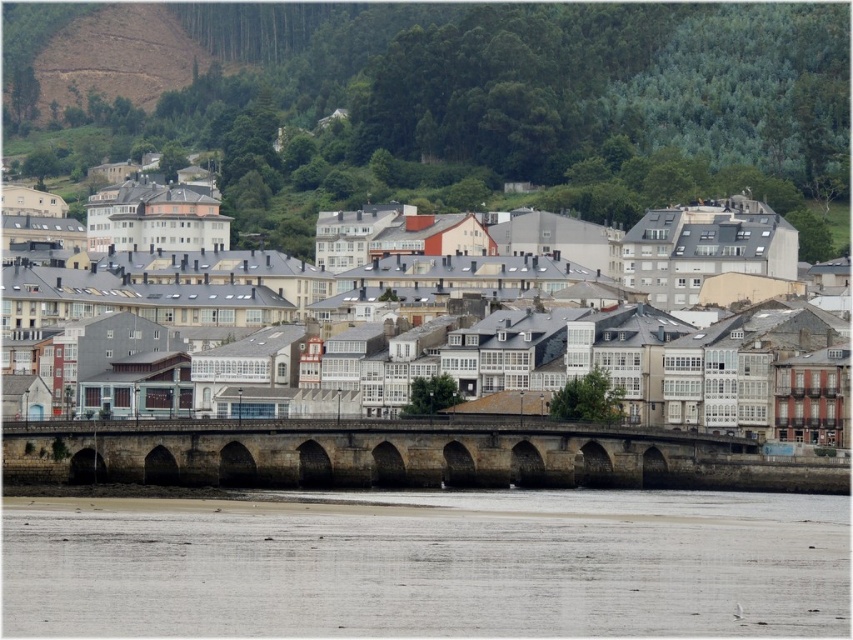
You are standing at the point closer to the camera between point (535, 230) and point (257, 442). Which point are you at?

You are at point (535, 230) because it is further to the camera than point (257, 442).

You are standing at the camera position in the riverside town scene. There is a specific point marked at coordinates point (128, 625). Can you safely walk to that point without getting wet?

The point (128, 625) is 78.87 meters away from the camera. Since the scene shows a wide expanse of water in the foreground with a sandy or muddy bank, it is likely that the point is on the bank. However, without knowing the exact path or terrain between you and the point, it is impossible to guarantee safety. Proceed with caution.

You are a tourist standing on the riverside bank. You want to take a photo that includes both the white stone buildings at center and the stone arch bridge at center. Which object should you position closer to the edge of your camera frame to ensure both fit in the shot?

Since the white stone buildings at center are wider than the stone arch bridge at center, you should position the white stone buildings at center closer to the edge of your camera frame to ensure both fit in the shot.